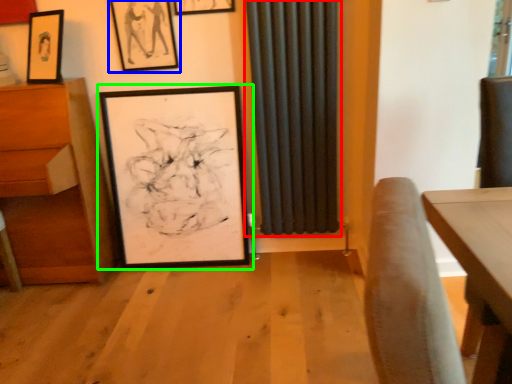
Question: Which is farther away from curtain (highlighted by a red box)? picture frame (highlighted by a blue box) or picture frame (highlighted by a green box)?

Choices:
 (A) picture frame
 (B) picture frame

Answer: (A)